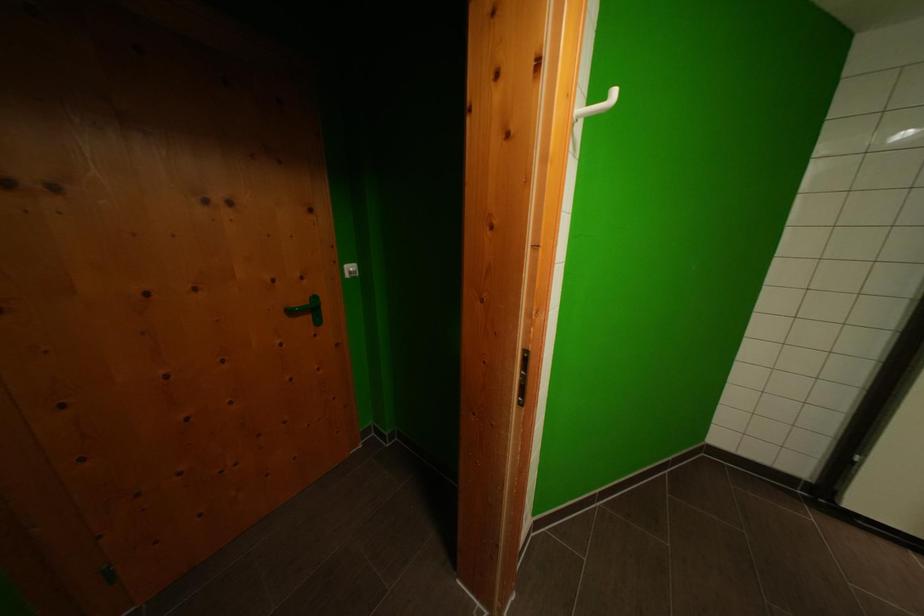
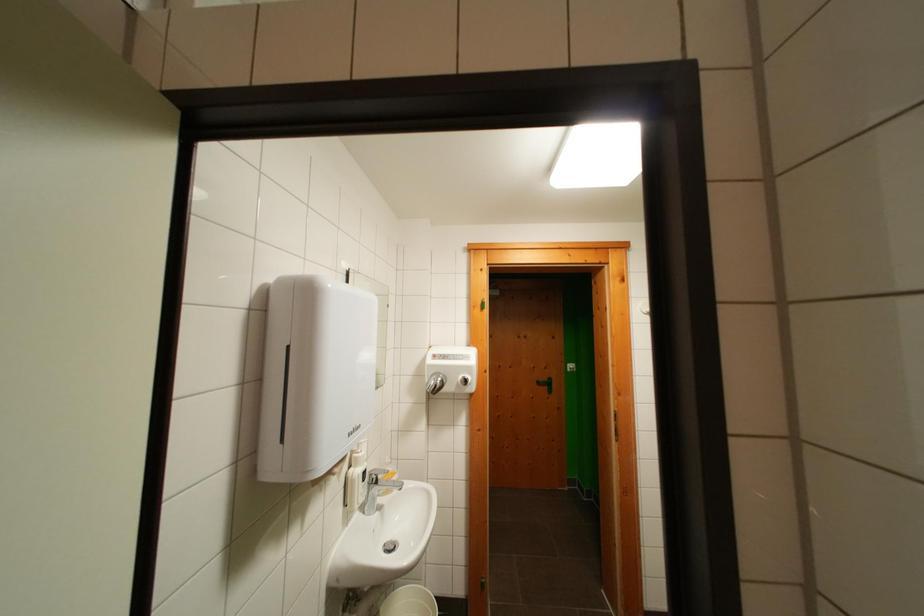
Where in the second image is the point corresponding to the point at 297,315 from the first image?

(544, 387)